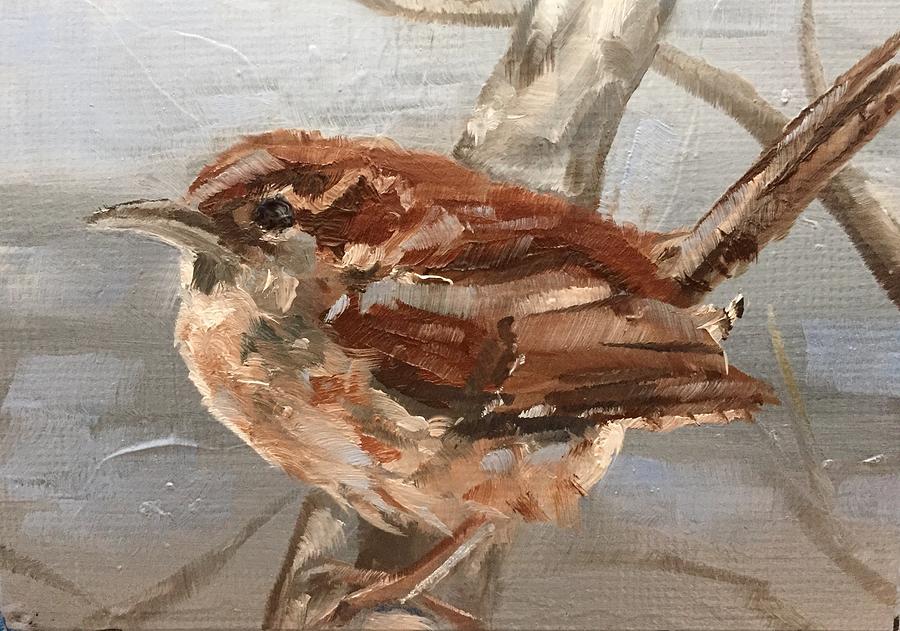
At what (x,y) coordinates should I click in order to perform the action: click on painting of bird. Please return your answer as a coordinate pair (x, y). This screenshot has width=900, height=631. Looking at the image, I should click on (418, 260).